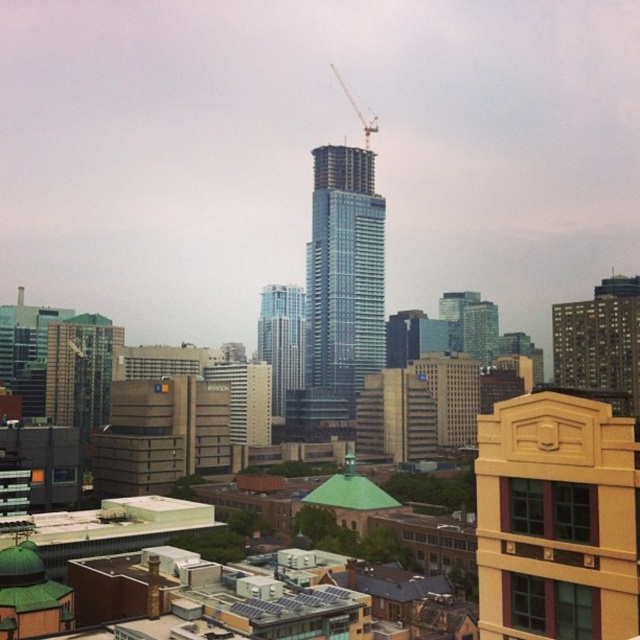
Is gold textured building at center wider than transparent glass skyscraper at center?

In fact, gold textured building at center might be narrower than transparent glass skyscraper at center.

Who is shorter, gold textured building at center or transparent glass skyscraper at center?

gold textured building at center is shorter.

Does point (525, 477) lie in front of point (342, 394)?

Yes, it is.

At what (x,y) coordinates should I click in order to perform the action: click on gold textured building at center. Please return your answer as a coordinate pair (x, y). This screenshot has height=640, width=640. Looking at the image, I should click on (556, 520).

Can you confirm if transparent glass skyscraper at center is positioned to the right of dark gray concrete building at right?

No, transparent glass skyscraper at center is not to the right of dark gray concrete building at right.

Who is lower down, transparent glass skyscraper at center or dark gray concrete building at right?

dark gray concrete building at right

Locate an element on the screen. This screenshot has width=640, height=640. transparent glass skyscraper at center is located at coordinates (344, 275).

You are a GUI agent. You are given a task and a screenshot of the screen. Output one action in this format:
    pyautogui.click(x=<x>, y=<y>)
    Task: Click on the dark gray concrete building at right
    Image resolution: width=640 pixels, height=640 pixels.
    Given the screenshot: What is the action you would take?
    pyautogui.click(x=600, y=340)

Can you confirm if dark gray concrete building at right is positioned to the right of metallic construction crane at upper center?

Yes, dark gray concrete building at right is to the right of metallic construction crane at upper center.

Between point (568, 307) and point (368, 148), which one is positioned in front?

Point (568, 307)

At what (x,y) coordinates should I click in order to perform the action: click on dark gray concrete building at right. Please return your answer as a coordinate pair (x, y). Image resolution: width=640 pixels, height=640 pixels. Looking at the image, I should click on (600, 340).